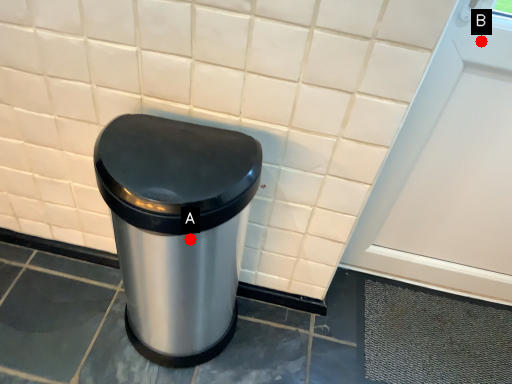
Question: Two points are circled on the image, labeled by A and B beside each circle. Which of the following is the closest to the observer?

Choices:
 (A) A is closer
 (B) B is closer

Answer: (A)